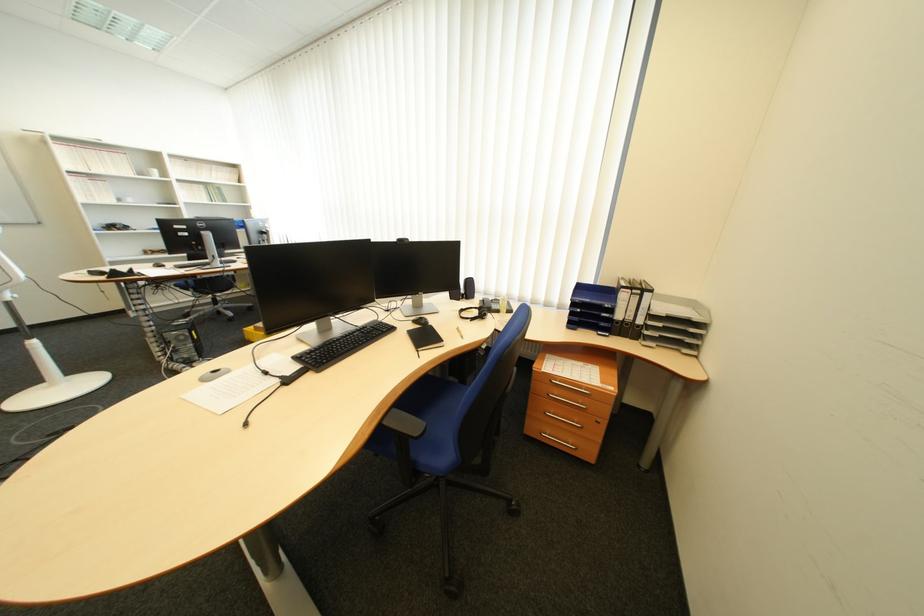
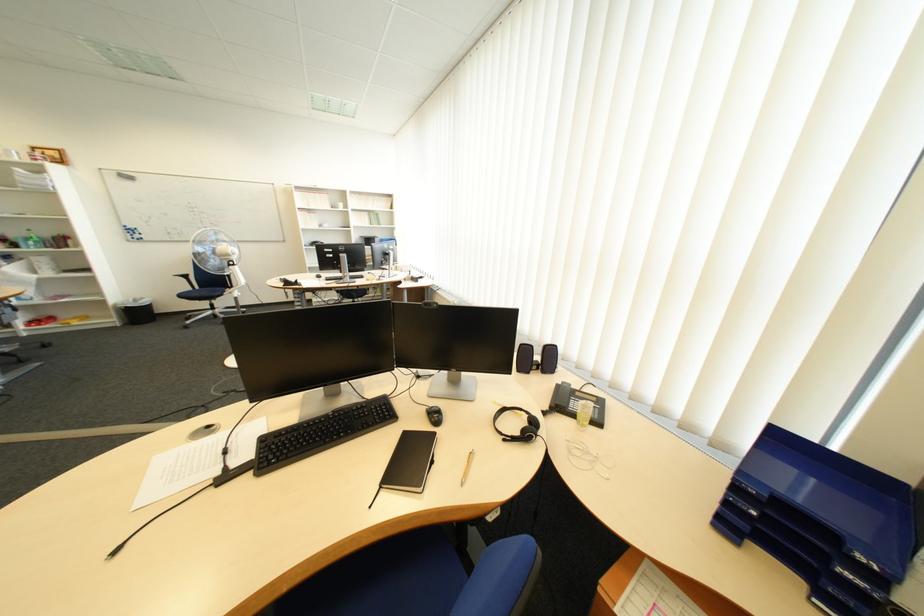
Find the pixel in the second image that matches the point at 574,309 in the first image.

(730, 446)